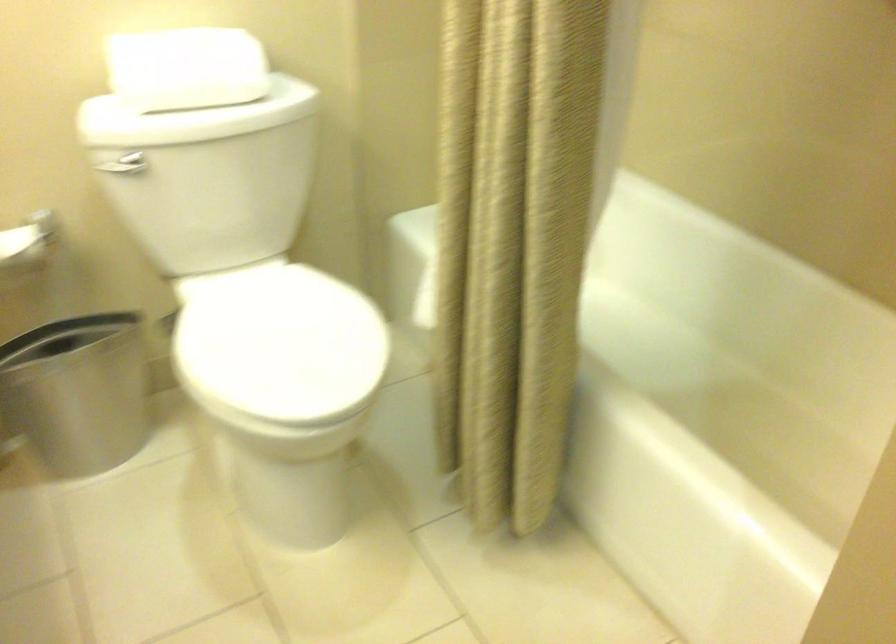
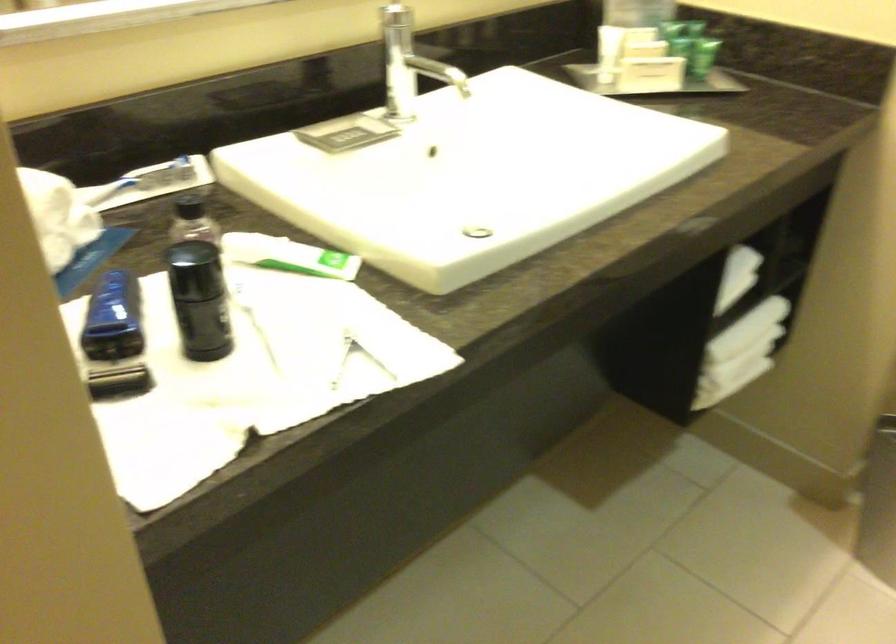
Based on the continuous images, in which direction is the camera rotating?

The camera's rotation is toward left-down.